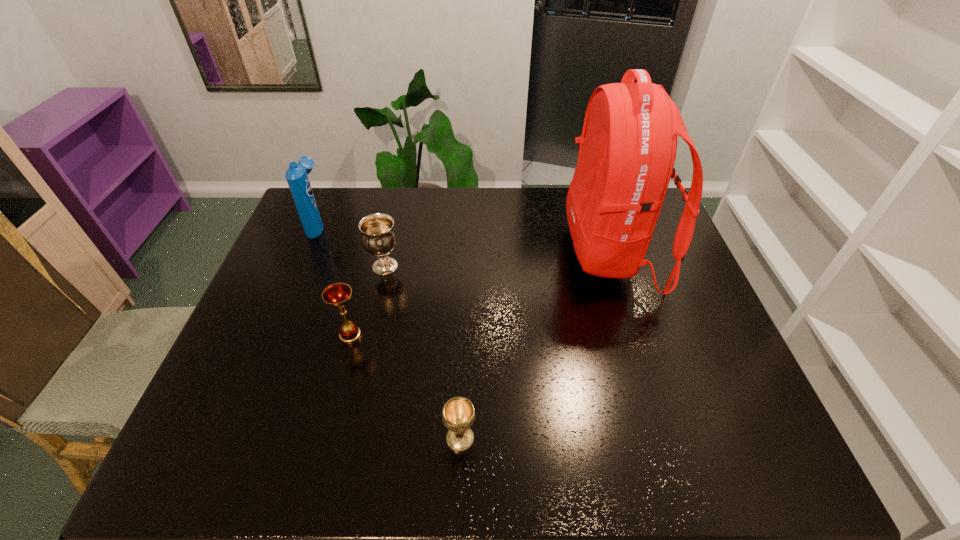
Locate an element on the screen. This screenshot has height=540, width=960. empty space that is in between the second object from right to left and the tallest object is located at coordinates (536, 346).

Where is `empty location between the rightmost object and the shampoo`? empty location between the rightmost object and the shampoo is located at coordinates (465, 239).

I want to click on vacant region between the second object from right to left and the farthest chalice, so click(x=422, y=353).

This screenshot has width=960, height=540. I want to click on empty location between the farthest chalice and the leftmost object, so click(351, 246).

Identify the location of empty space between the backpack and the shampoo. (465, 239).

At what (x,y) coordinates should I click in order to perform the action: click on blank region between the rightmost chalice and the leftmost object. Please return your answer as a coordinate pair (x, y). This screenshot has height=540, width=960. Looking at the image, I should click on (389, 332).

Identify which object is the fourth nearest to the nearest chalice. Please provide its 2D coordinates. Your answer should be formatted as a tuple, i.e. [(x, y)], where the tuple contains the x and y coordinates of a point satisfying the conditions above.

[(296, 175)]

Identify which object is the nearest to the farthest chalice. Please provide its 2D coordinates. Your answer should be formatted as a tuple, i.e. [(x, y)], where the tuple contains the x and y coordinates of a point satisfying the conditions above.

[(336, 295)]

Image resolution: width=960 pixels, height=540 pixels. In order to click on the closest chalice relative to the farthest chalice in this screenshot , I will do `click(336, 295)`.

Where is `chalice that stands as the third closest to the backpack`? The image size is (960, 540). chalice that stands as the third closest to the backpack is located at coordinates (336, 295).